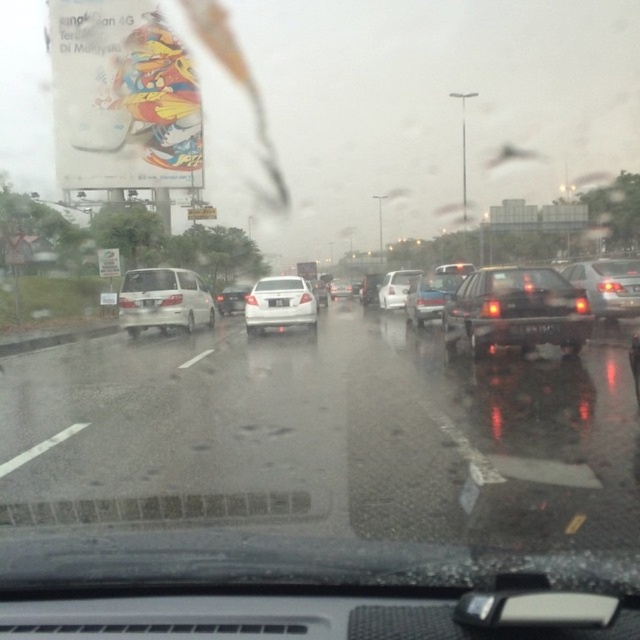
Based on the photo, you are a passenger in the car and looking at the road ahead. There is a point marked at coordinates [280,307]. What object is located at that point?

The point at coordinates [280,307] marks the white matte sedan at center.